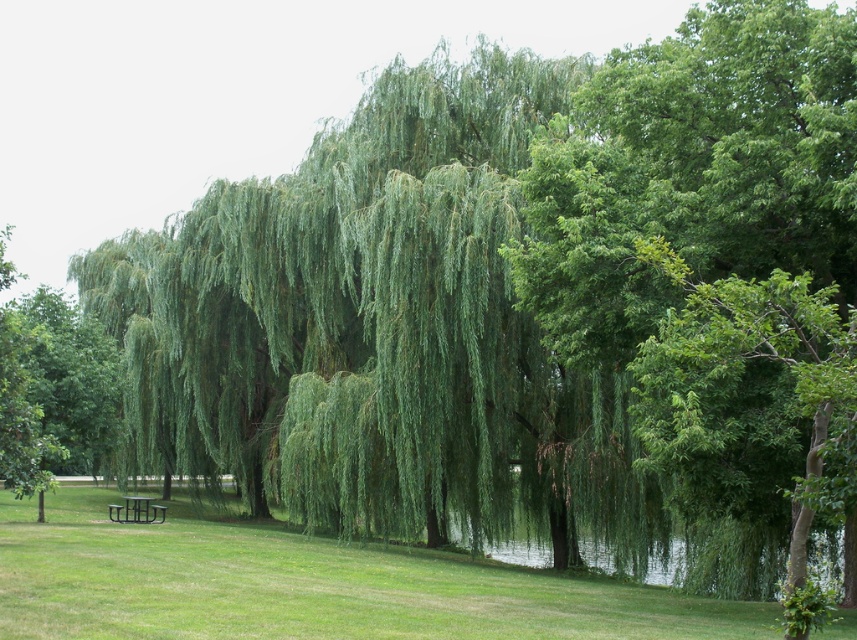
You are standing in the park and want to reach a specific point marked at coordinates point (518, 616). If your walking speed is 3 feet per second, how many seconds will it take you to reach that point?

The distance of point (518, 616) from viewer is 43.25 feet. At a speed of 3 feet per second, it will take 43.25 divided by 3, which is approximately 14.42 seconds to reach the point.